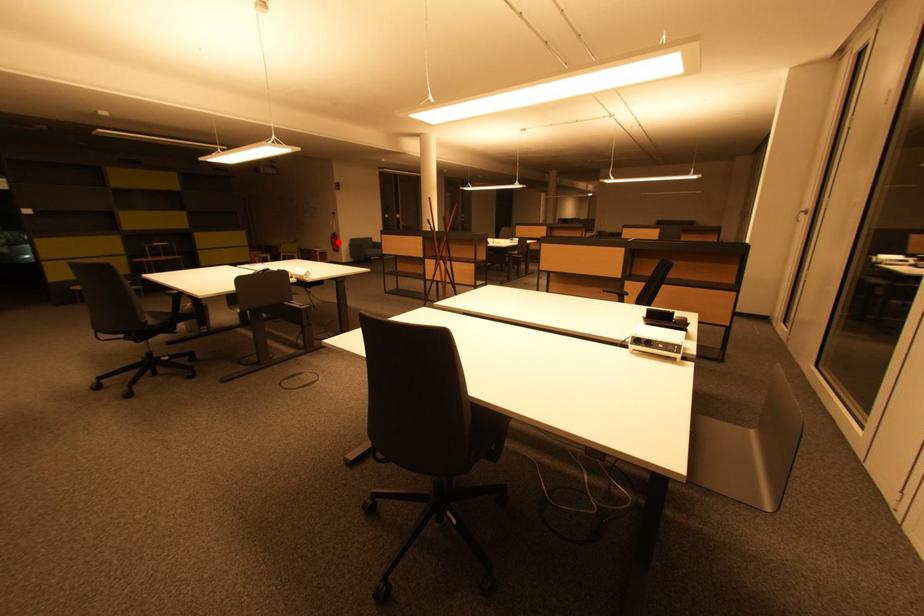
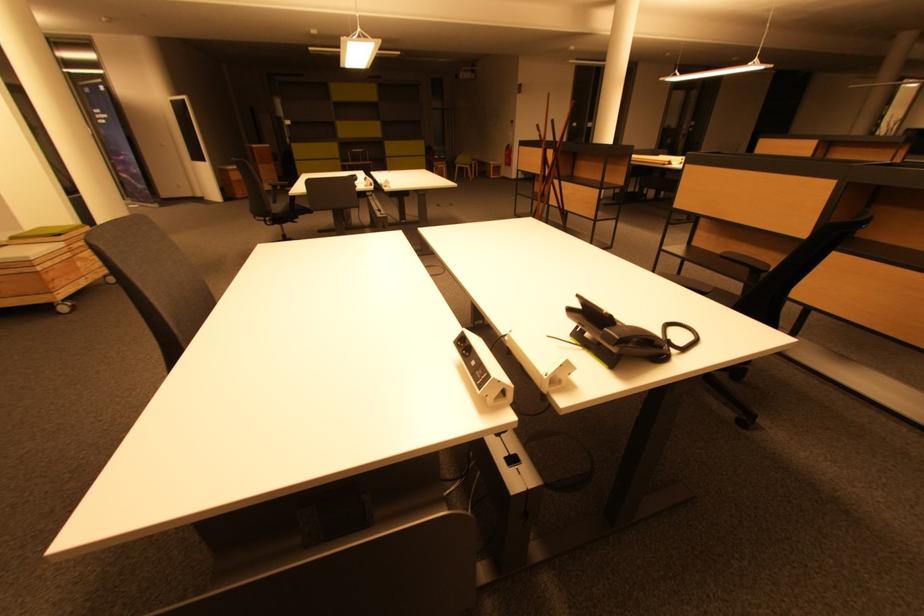
The point at the highlighted location is marked in the first image. Where is the corresponding point in the second image?

(512, 155)